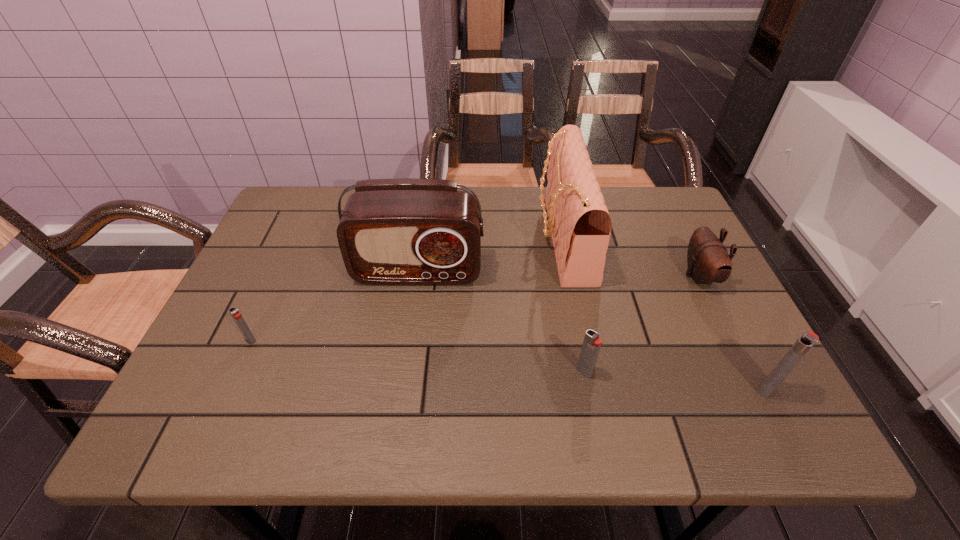
Locate which igniter ranks second in proximity to the second igniter from left to right. Please provide its 2D coordinates. Your answer should be formatted as a tuple, i.e. [(x, y)], where the tuple contains the x and y coordinates of a point satisfying the conditions above.

[(234, 312)]

Locate an element on the screen. This screenshot has width=960, height=540. free region that satisfies the following two spatial constraints: 1. on the front-facing side of the handbag; 2. on the left side of the nearest igniter is located at coordinates (594, 389).

This screenshot has height=540, width=960. In order to click on free space that satisfies the following two spatial constraints: 1. on the front-facing side of the handbag; 2. on the front panel of the radio receiver in this screenshot , I will do `click(570, 271)`.

This screenshot has width=960, height=540. I want to click on free location that satisfies the following two spatial constraints: 1. on the back side of the tallest igniter; 2. on the front-facing side of the handbag, so click(688, 238).

Locate an element on the screen. free region that satisfies the following two spatial constraints: 1. on the front panel of the second object from left to right; 2. on the right side of the nearest object is located at coordinates (401, 389).

Where is `free space that satisfies the following two spatial constraints: 1. with the flap open on the nearest object; 2. on the right side of the pouch`? free space that satisfies the following two spatial constraints: 1. with the flap open on the nearest object; 2. on the right side of the pouch is located at coordinates (756, 389).

Where is `free location that satisfies the following two spatial constraints: 1. with the flap open on the pouch; 2. on the right side of the rightmost igniter`? The image size is (960, 540). free location that satisfies the following two spatial constraints: 1. with the flap open on the pouch; 2. on the right side of the rightmost igniter is located at coordinates (756, 389).